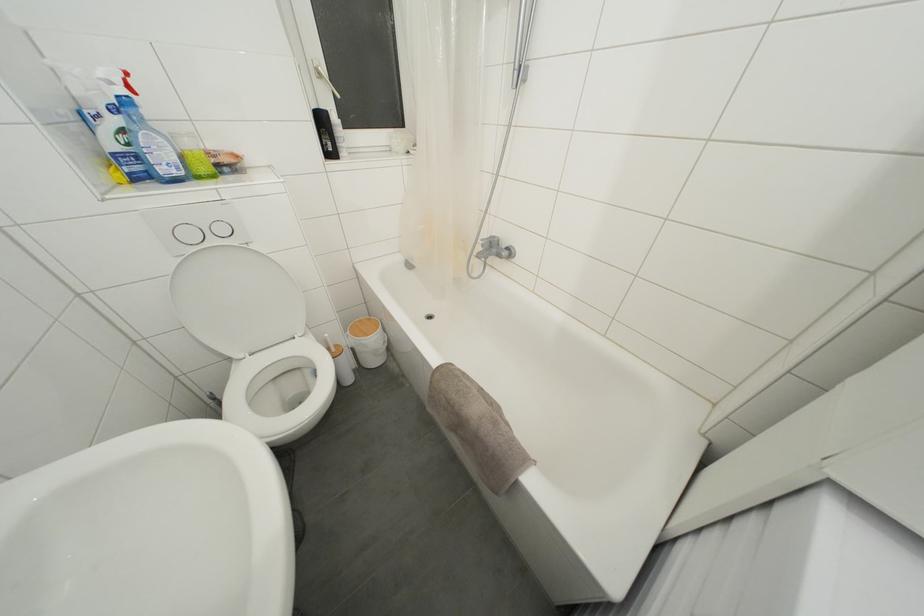
Where would you pull the silver faucet handle? Please return your answer as a coordinate pair (x, y).

(490, 241)